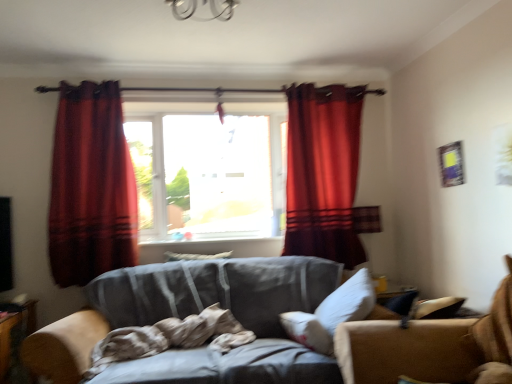
Question: From a real-world perspective, is white soft pillow at center, the 1th pillow when ordered from bottom to top, on white soft pillow at center, positioned as the second pillow in front-to-back order?

Choices:
 (A) no
 (B) yes

Answer: (A)

Question: Does white soft pillow at center, the 1th pillow when ordered from bottom to top, have a lesser height compared to white soft pillow at center, the 1th pillow from the top?

Choices:
 (A) no
 (B) yes

Answer: (A)

Question: Does white soft pillow at center, placed as the second pillow when sorted from left to right, turn towards white soft pillow at center, the 1th pillow from the top?

Choices:
 (A) no
 (B) yes

Answer: (A)

Question: From the image's perspective, is white soft pillow at center, the second pillow viewed from the top, located beneath white soft pillow at center, which is the first pillow from left to right?

Choices:
 (A) no
 (B) yes

Answer: (B)

Question: Considering the relative positions of white soft pillow at center, the second pillow viewed from the top, and white soft pillow at center, positioned as the second pillow in front-to-back order, in the image provided, is white soft pillow at center, the second pillow viewed from the top, behind white soft pillow at center, positioned as the second pillow in front-to-back order,?

Choices:
 (A) no
 (B) yes

Answer: (A)

Question: Is velvet red curtain at left, the 2th curtain in the right-to-left sequence, to the left or to the right of white soft pillow at center, marked as the 1th pillow in a back-to-front arrangement, in the image?

Choices:
 (A) left
 (B) right

Answer: (A)

Question: From a real-world perspective, is velvet red curtain at left, the 2th curtain in the right-to-left sequence, positioned above or below white soft pillow at center, marked as the 1th pillow in a back-to-front arrangement?

Choices:
 (A) above
 (B) below

Answer: (A)

Question: Is velvet red curtain at left, the 2th curtain in the right-to-left sequence, in front of or behind white soft pillow at center, positioned as the second pillow in front-to-back order, in the image?

Choices:
 (A) behind
 (B) front

Answer: (B)

Question: Considering the positions of velvet red curtain at left, arranged as the first curtain when viewed from the left, and white soft pillow at center, positioned as the second pillow in front-to-back order, in the image, is velvet red curtain at left, arranged as the first curtain when viewed from the left, wider or thinner than white soft pillow at center, positioned as the second pillow in front-to-back order,?

Choices:
 (A) wide
 (B) thin

Answer: (A)

Question: Is velvet red curtain at center, which appears as the 1th curtain when viewed from the right, taller or shorter than white soft pillow at center, which ranks as the first pillow in right-to-left order?

Choices:
 (A) short
 (B) tall

Answer: (B)

Question: Is velvet red curtain at center, positioned as the 2th curtain in left-to-right order, inside the boundaries of white soft pillow at center, placed as the second pillow when sorted from left to right, or outside?

Choices:
 (A) outside
 (B) inside

Answer: (A)

Question: From a real-world perspective, is velvet red curtain at center, positioned as the 2th curtain in left-to-right order, positioned above or below white soft pillow at center, positioned as the first pillow in front-to-back order?

Choices:
 (A) above
 (B) below

Answer: (A)

Question: In terms of width, does velvet red curtain at center, positioned as the 2th curtain in left-to-right order, look wider or thinner when compared to white soft pillow at center, the second pillow viewed from the top?

Choices:
 (A) wide
 (B) thin

Answer: (B)

Question: In terms of height, does gray fabric couch at center look taller or shorter compared to velvet red curtain at center, which appears as the 1th curtain when viewed from the right?

Choices:
 (A) tall
 (B) short

Answer: (B)

Question: Is gray fabric couch at center wider or thinner than velvet red curtain at center, which appears as the 1th curtain when viewed from the right?

Choices:
 (A) thin
 (B) wide

Answer: (B)